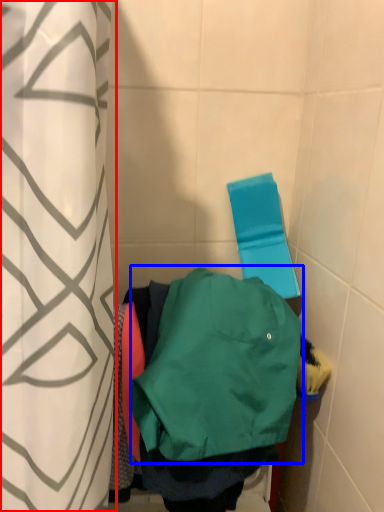
Question: Which object is closer to the camera taking this photo, curtain (highlighted by a red box) or sweatshirt (highlighted by a blue box)?

Choices:
 (A) curtain
 (B) sweatshirt

Answer: (A)